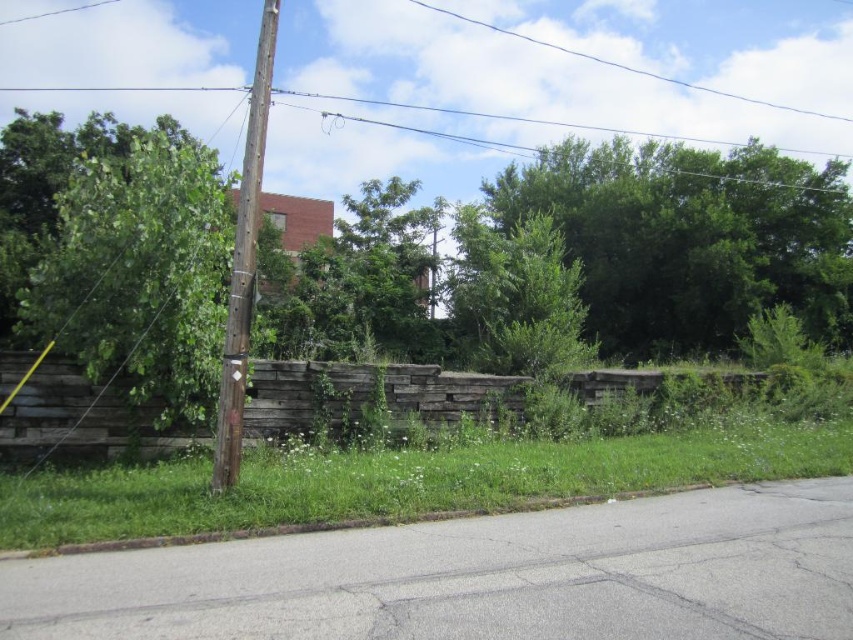
Does green grass at center have a smaller size compared to brown wooden telegraph pole at center-left?

Yes, green grass at center is smaller than brown wooden telegraph pole at center-left.

Does green grass at center appear under brown wooden telegraph pole at center-left?

Yes, green grass at center is below brown wooden telegraph pole at center-left.

Which is in front, point (135, 532) or point (241, 253)?

Positioned in front is point (135, 532).

Where is `green grass at center`? green grass at center is located at coordinates (402, 481).

Can you confirm if weathered wood fence at center is smaller than green leafy tree at center?

Yes.

Can you confirm if weathered wood fence at center is shorter than green leafy tree at center?

Yes.

Is point (392, 376) closer to camera compared to point (323, 259)?

Yes, point (392, 376) is in front of point (323, 259).

Find the location of `weathered wood fence at center`. weathered wood fence at center is located at coordinates (80, 420).

Is point (700, 166) positioned before point (421, 269)?

That is False.

Measure the distance between point (711, 198) and camera.

Point (711, 198) and camera are 31.36 meters apart from each other.

Locate an element on the screen. Image resolution: width=853 pixels, height=640 pixels. green leafy tree at upper center is located at coordinates (689, 237).